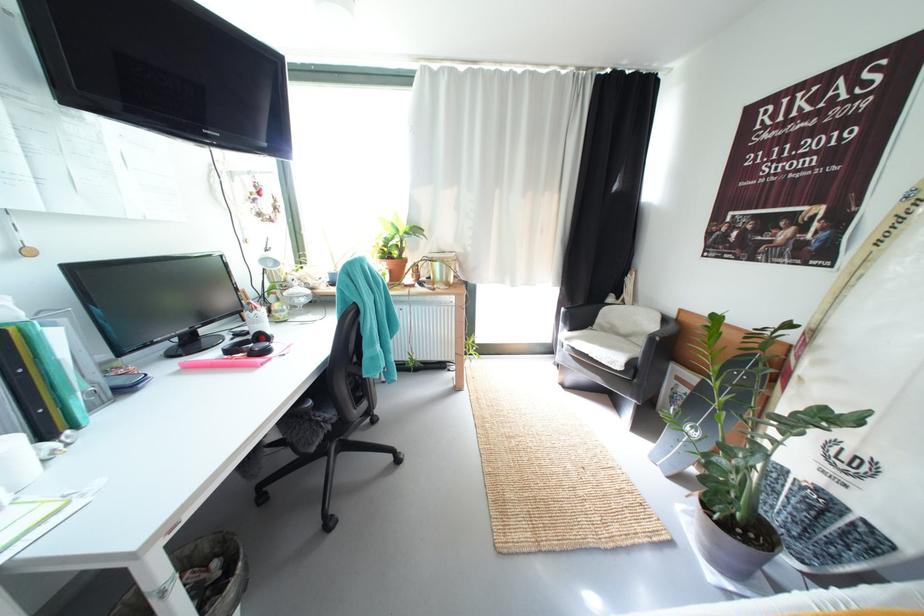
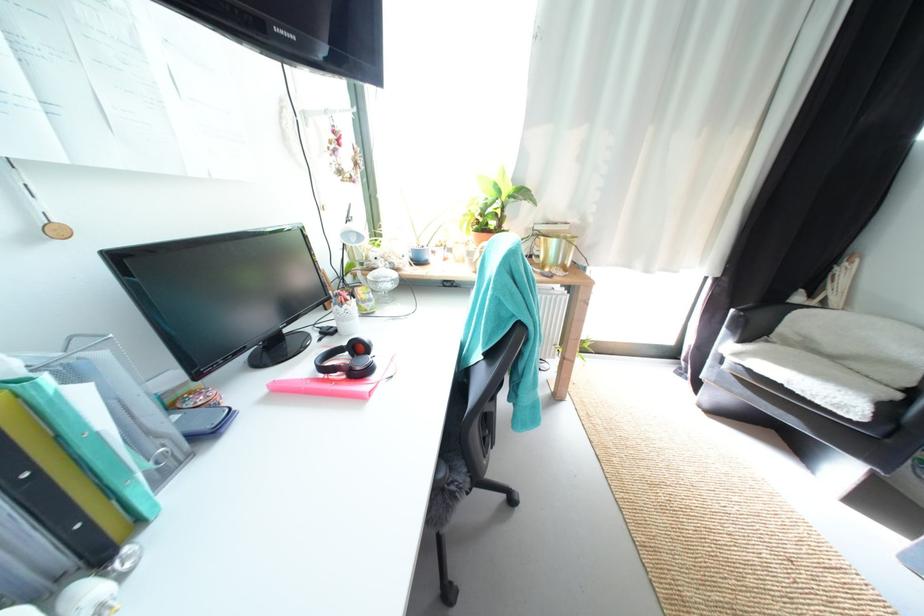
Where in the second image is the point corresponding to point (188, 366) from the first image?

(275, 387)